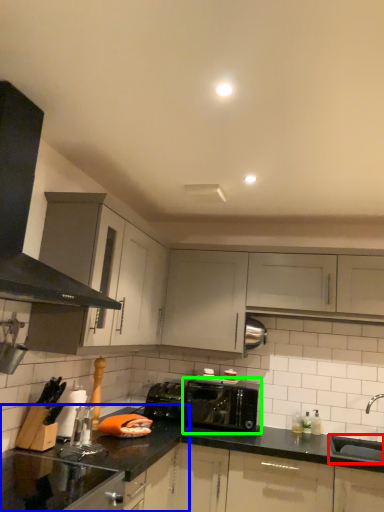
Question: Estimate the real-world distances between objects in this image. Which object is closer to sink (highlighted by a red box), countertop (highlighted by a blue box) or toaster (highlighted by a green box)?

Choices:
 (A) countertop
 (B) toaster

Answer: (B)